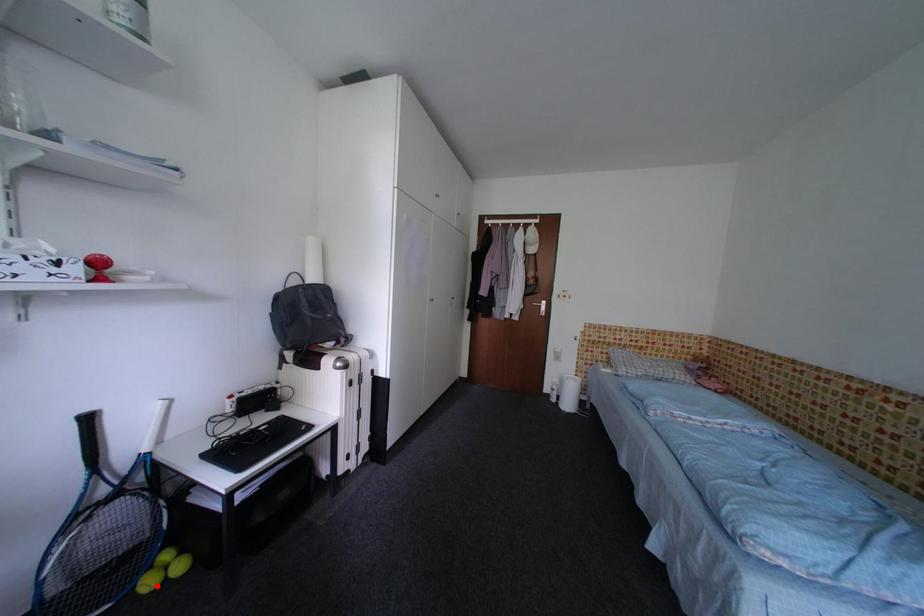
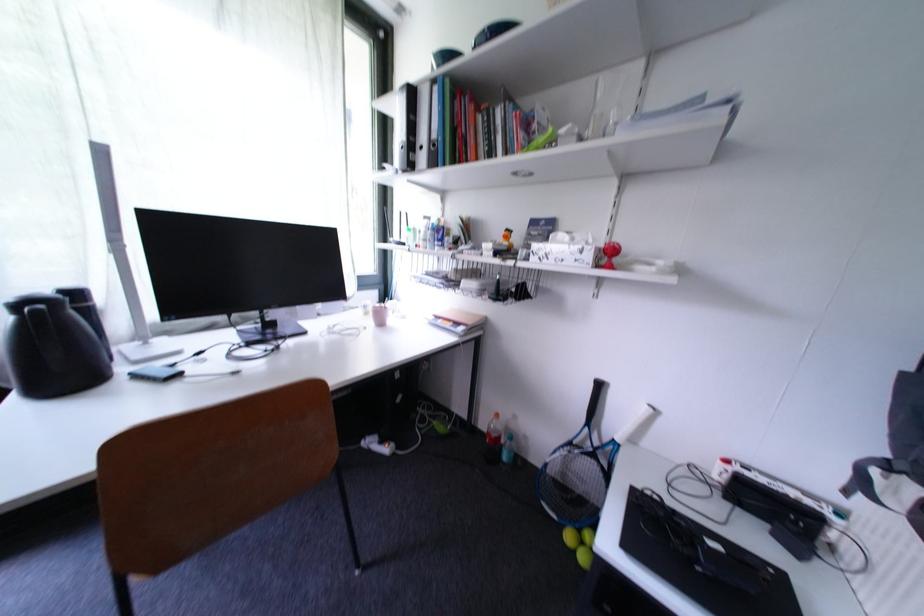
The point at the highlighted location is marked in the first image. Where is the corresponding point in the second image?

(578, 540)